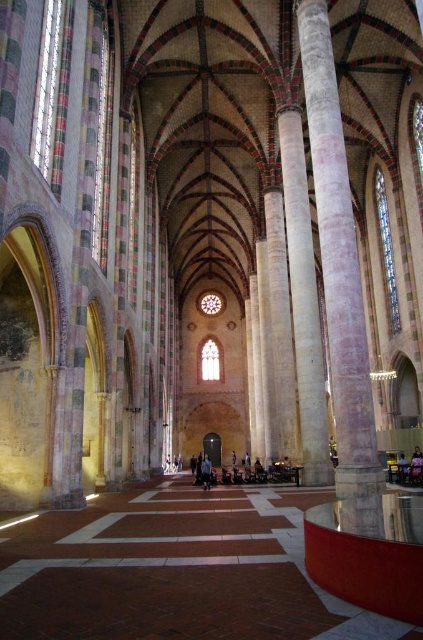
Question: Does white marble pillar at right appear on the left side of blue denim jeans at center?

Choices:
 (A) yes
 (B) no

Answer: (B)

Question: Estimate the real-world distances between objects in this image. Which object is farther from the clear glass window at center?

Choices:
 (A) clear glass window at left
 (B) blue denim jeans at center

Answer: (A)

Question: Estimate the real-world distances between objects in this image. Which object is farther from the stained glass window at right?

Choices:
 (A) white marble pillar at right
 (B) clear glass window at left
 (C) blue denim jeans at center

Answer: (B)

Question: Is stained glass window at right bigger than blue denim jeans at center?

Choices:
 (A) yes
 (B) no

Answer: (B)

Question: Can you confirm if white marble pillar at center is wider than stained glass window at right?

Choices:
 (A) yes
 (B) no

Answer: (A)

Question: Which of the following is the farthest from the observer?

Choices:
 (A) (379, 205)
 (B) (51, 44)
 (C) (308, 352)
 (D) (219, 362)

Answer: (D)